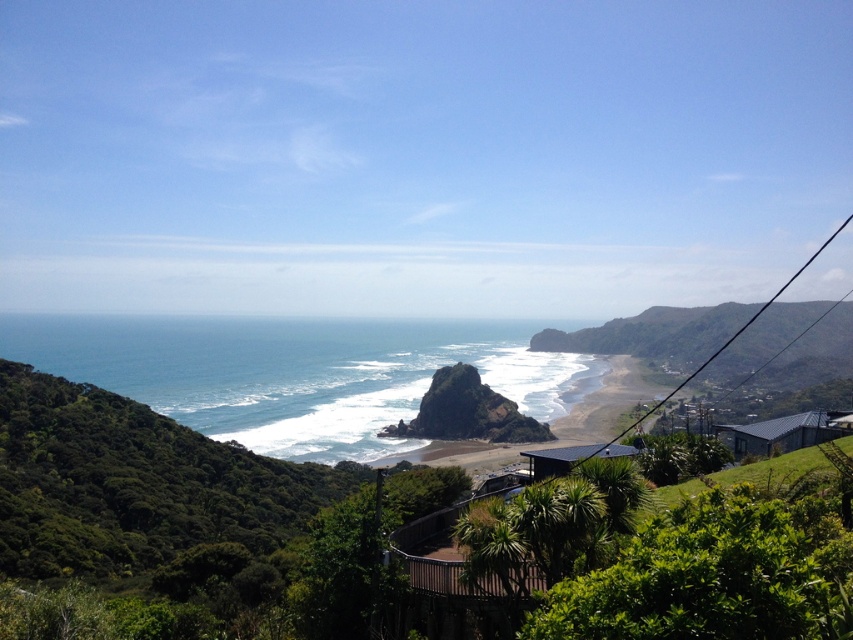
Does point (575, 323) lie in front of point (614, 448)?

That is False.

Is blue ocean water at center above green corrugated metal hut at center?

Yes.

Who is more distant from viewer, (39, 324) or (579, 451)?

Positioned behind is point (39, 324).

What are the coordinates of `blue ocean water at center` in the screenshot? It's located at (299, 372).

Is gray corrugated metal hut at lower right above green corrugated metal hut at center?

Indeed, gray corrugated metal hut at lower right is positioned over green corrugated metal hut at center.

At what (x,y) coordinates should I click in order to perform the action: click on gray corrugated metal hut at lower right. Please return your answer as a coordinate pair (x, y). This screenshot has width=853, height=640. Looking at the image, I should click on (785, 433).

Does blue ocean water at center come in front of gray corrugated metal hut at lower right?

That is False.

Who is shorter, blue ocean water at center or gray corrugated metal hut at lower right?

Standing shorter between the two is gray corrugated metal hut at lower right.

Does point (289, 349) lie behind point (738, 452)?

Yes.

Find the location of a particular element. blue ocean water at center is located at coordinates (299, 372).